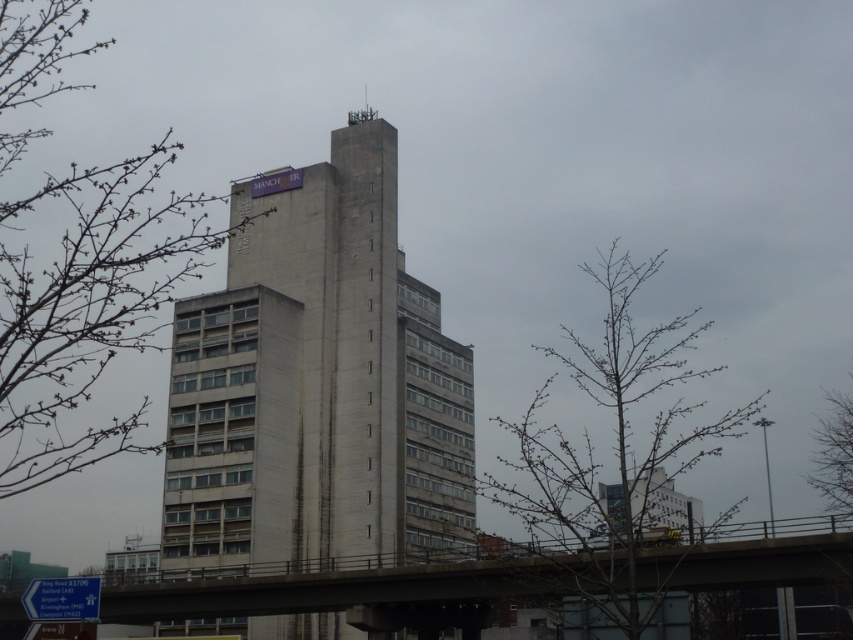
Question: Which object appears closest to the camera in this image?

Choices:
 (A) concrete building at center
 (B) blue plastic sign at lower left

Answer: (B)

Question: Which of the following is the closest to the observer?

Choices:
 (A) bare branches at upper left
 (B) blue plastic sign at lower left

Answer: (A)

Question: Is concrete bridge at lower center thinner than blue plastic sign at lower left?

Choices:
 (A) yes
 (B) no

Answer: (B)

Question: Does bare branches at upper left have a lesser width compared to bare branches at center?

Choices:
 (A) no
 (B) yes

Answer: (A)

Question: Can you confirm if concrete building at center is bigger than bare branches at lower right?

Choices:
 (A) yes
 (B) no

Answer: (A)

Question: Among these points, which one is nearest to the camera?

Choices:
 (A) (310, 316)
 (B) (793, 548)
 (C) (103, 232)

Answer: (C)